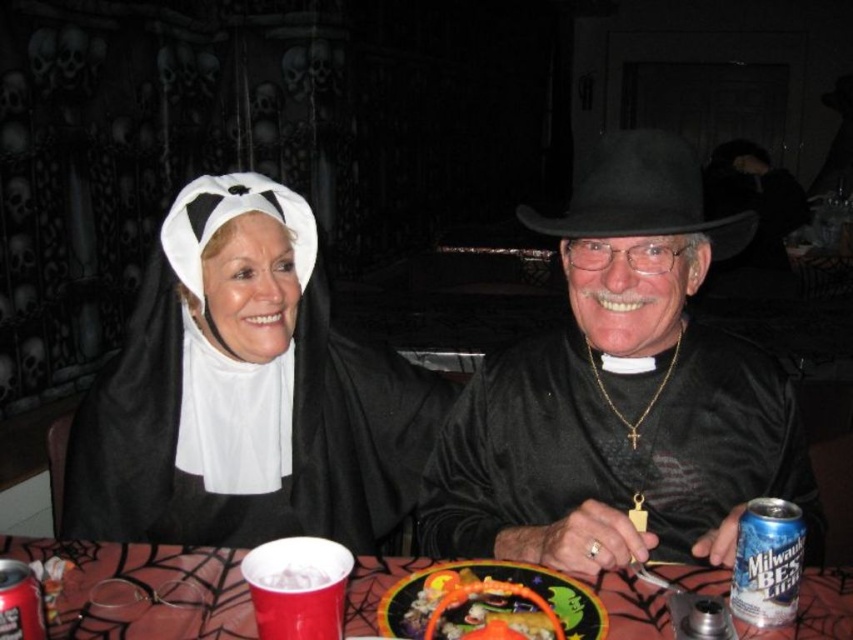
Question: Which object appears farthest from the camera in this image?

Choices:
 (A) orange plastic basket at center
 (B) black felt cowboy hat at center

Answer: (B)

Question: Which point is closer to the camera?

Choices:
 (A) black velvet hat at center
 (B) black felt cowboy hat at center
 (C) silver metallic can at lower right

Answer: (C)

Question: Is matte black nun costume at left to the left of silver metallic can at lower right from the viewer's perspective?

Choices:
 (A) no
 (B) yes

Answer: (B)

Question: Which point is farther to the camera?

Choices:
 (A) black velvet hat at center
 (B) silver metallic can at lower right

Answer: (A)

Question: Can you confirm if black velvet hat at center is wider than matte black nun costume at left?

Choices:
 (A) yes
 (B) no

Answer: (B)

Question: Can you confirm if matte black nun costume at left is positioned below orange plastic basket at center?

Choices:
 (A) no
 (B) yes

Answer: (A)